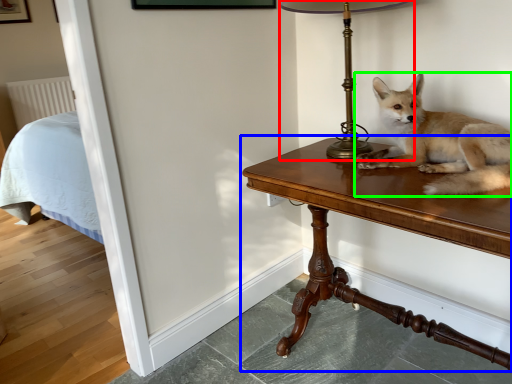
Question: Considering the real-world distances, which object is farthest from table lamp (highlighted by a red box)? table (highlighted by a blue box) or dog (highlighted by a green box)?

Choices:
 (A) table
 (B) dog

Answer: (A)